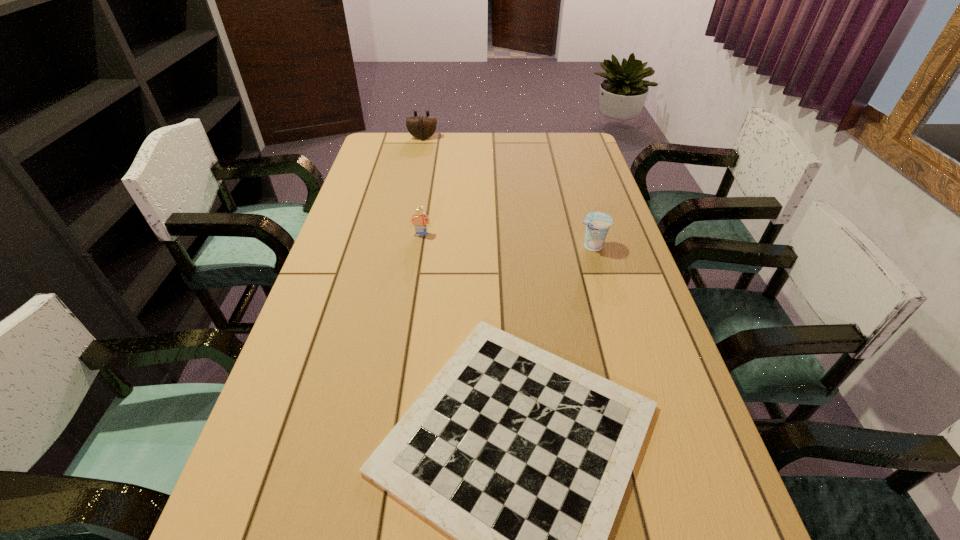
In the image, there is a desktop. Identify the location of vacant space at the far edge. Image resolution: width=960 pixels, height=540 pixels. (534, 137).

In the image, there is a desktop. Where is `free space at the left edge`? Image resolution: width=960 pixels, height=540 pixels. free space at the left edge is located at coordinates (396, 183).

Find the location of `free space at the right edge of the desktop`. free space at the right edge of the desktop is located at coordinates (647, 513).

In the image, there is a desktop. At what (x,y) coordinates should I click in order to perform the action: click on vacant area at the far left corner. Please return your answer as a coordinate pair (x, y). Looking at the image, I should click on [x=372, y=141].

Identify the location of free space at the far right corner of the desktop. The image size is (960, 540). (580, 143).

I want to click on free spot between the second farthest object and the farthest object, so click(x=422, y=186).

What are the coordinates of `empty location between the pouch and the third farthest object` in the screenshot? It's located at (507, 192).

Find the location of a particular element. unoccupied position between the yogurt and the third nearest object is located at coordinates (507, 240).

I want to click on vacant area between the pouch and the Lego, so click(422, 186).

The width and height of the screenshot is (960, 540). I want to click on empty space that is in between the third nearest object and the third farthest object, so 507,240.